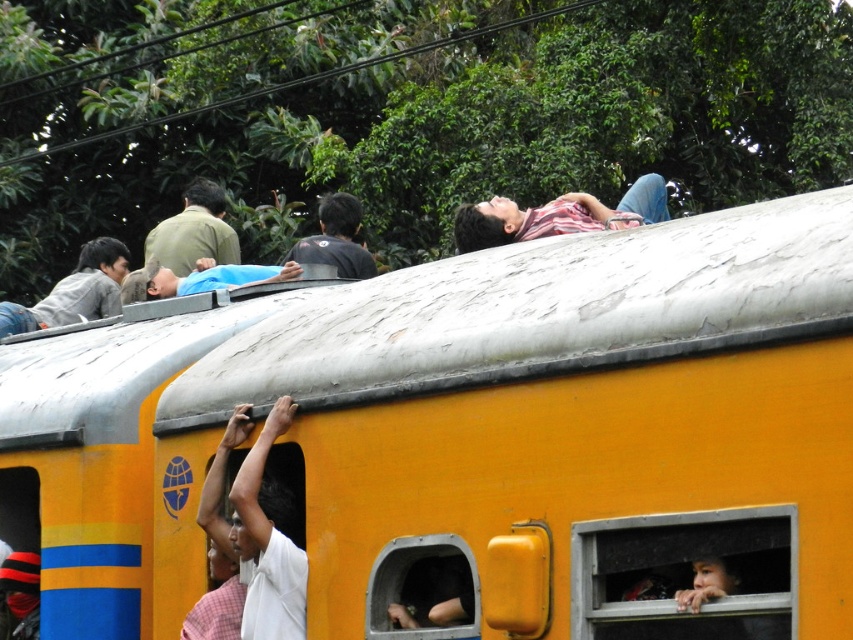
In the scene shown: You are a passenger on the yellow train and want to take a photo of the scenic view outside. Which window, the transparent glass window at lower right or the metallic gray window at center, would allow you to capture a wider shot of the landscape?

The transparent glass window at lower right has a larger width than the metallic gray window at center, so it would allow you to capture a wider shot of the landscape.

You are a photographer trying to capture a clear shot of both the striped fabric shirt at top and the black matte shirt at upper center. Which one will appear larger in your photo?

The striped fabric shirt at top will appear larger in the photo because it is closer to the viewer than the black matte shirt at upper center.